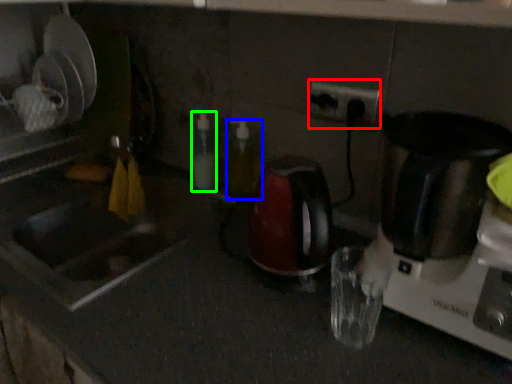
Question: Which is nearer to the electric outlet (highlighted by a red box)? bottle (highlighted by a blue box) or bottle (highlighted by a green box).

Choices:
 (A) bottle
 (B) bottle

Answer: (A)